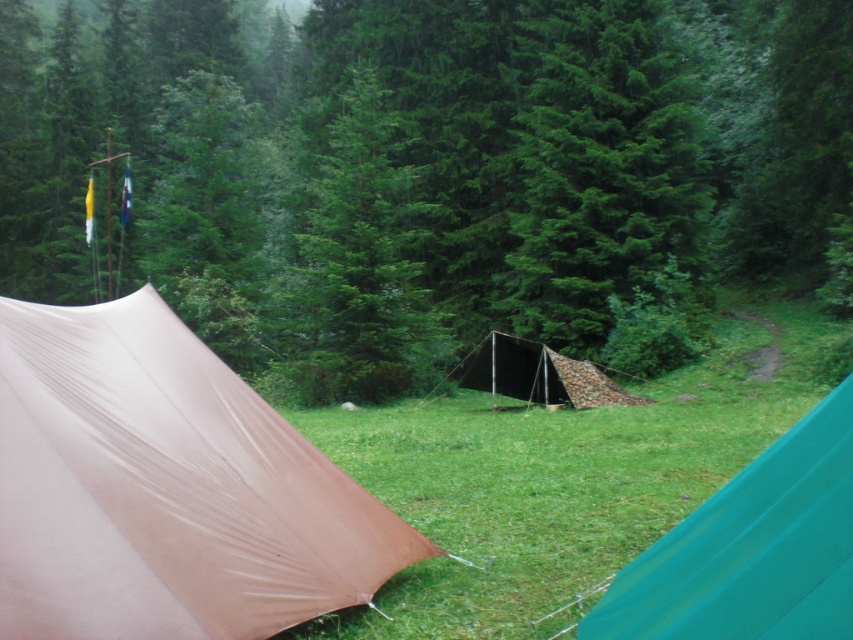
Which is behind, point (664, 147) or point (807, 464)?

The point (664, 147) is more distant.

Does green matte tree at upper center come behind camo fabric tent at center?

Yes, green matte tree at upper center is behind camo fabric tent at center.

Is point (86, 61) less distant than point (741, 541)?

No, (86, 61) is further to viewer.

This screenshot has width=853, height=640. I want to click on green matte tree at upper center, so click(427, 172).

Can you confirm if tan fabric tent at left is positioned below green grass at center?

No, tan fabric tent at left is not below green grass at center.

Does tan fabric tent at left appear over green grass at center?

Yes, tan fabric tent at left is above green grass at center.

Describe the element at coordinates (165, 488) in the screenshot. The image size is (853, 640). I see `tan fabric tent at left` at that location.

In order to click on tan fabric tent at left in this screenshot , I will do `click(165, 488)`.

Is point (769, 577) positioned in front of point (590, 397)?

Yes, it is.

Can you confirm if camo fabric tent at center is thinner than camouflage fabric tent at center?

Indeed, camo fabric tent at center has a lesser width compared to camouflage fabric tent at center.

You are a GUI agent. You are given a task and a screenshot of the screen. Output one action in this format:
    pyautogui.click(x=<x>, y=<y>)
    Task: Click on the camo fabric tent at center
    This screenshot has width=853, height=640.
    Given the screenshot: What is the action you would take?
    pyautogui.click(x=752, y=548)